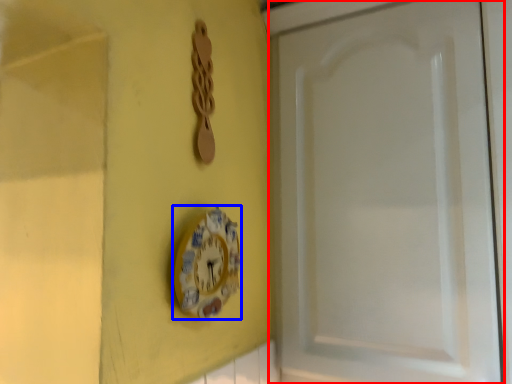
Question: Which object appears farthest to the camera in this image, screen door (highlighted by a red box) or wall clock (highlighted by a blue box)?

Choices:
 (A) screen door
 (B) wall clock

Answer: (A)